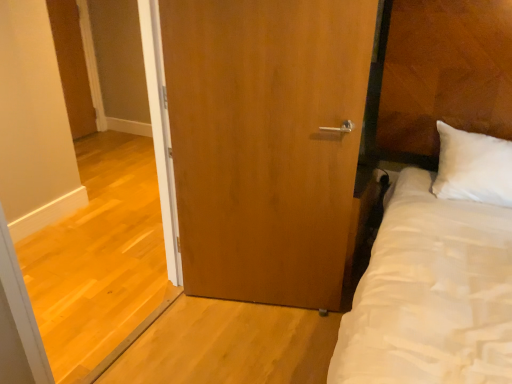
Locate an element on the screen. The height and width of the screenshot is (384, 512). wooden door at center is located at coordinates (266, 142).

In order to face wooden door at center, should I rotate leftwards or rightwards?

Rotate right and turn 0.189 degrees.

What do you see at coordinates (266, 142) in the screenshot? Image resolution: width=512 pixels, height=384 pixels. I see `wooden door at center` at bounding box center [266, 142].

I want to click on wooden door at center, so (x=266, y=142).